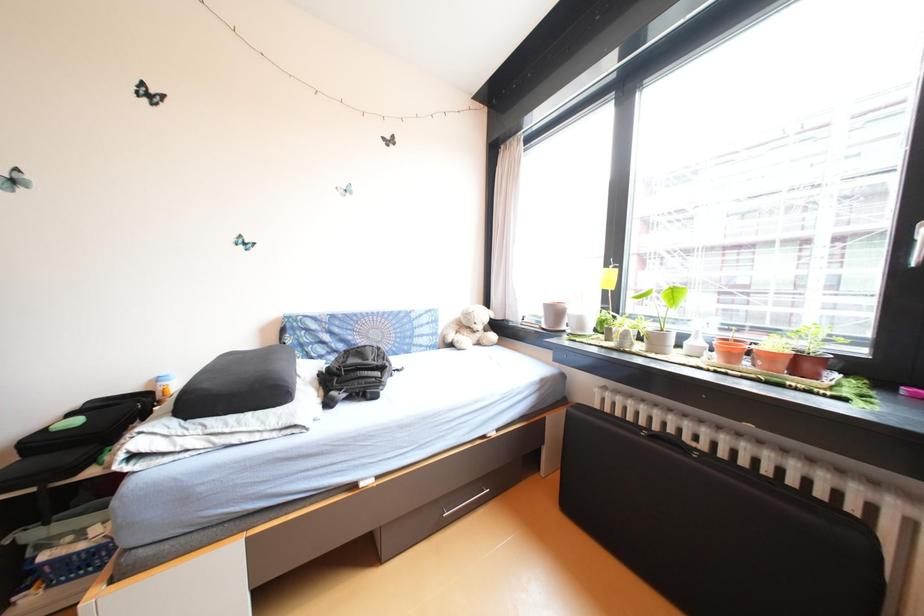
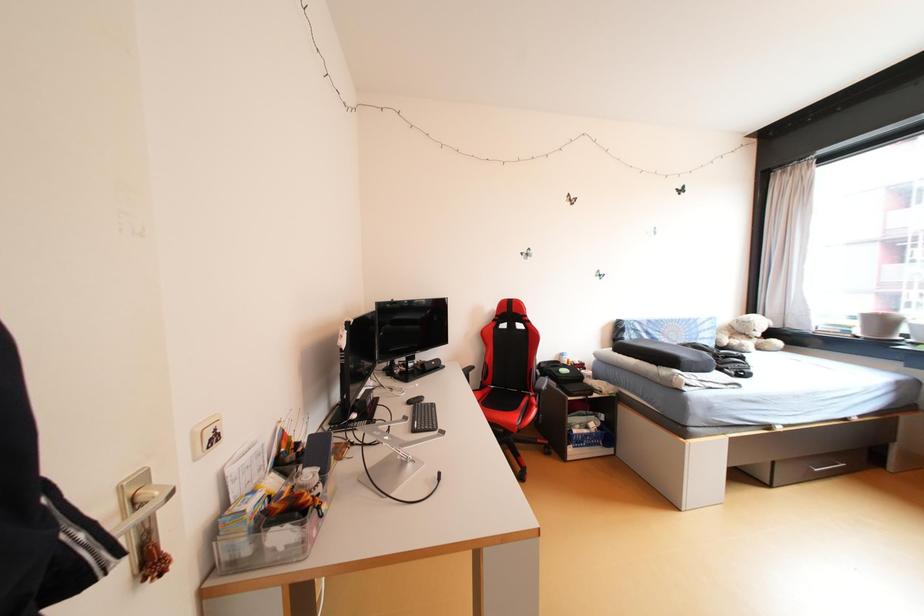
In a continuous first-person perspective shot, in which direction is the camera moving?

The cameraman moved toward left, backward.